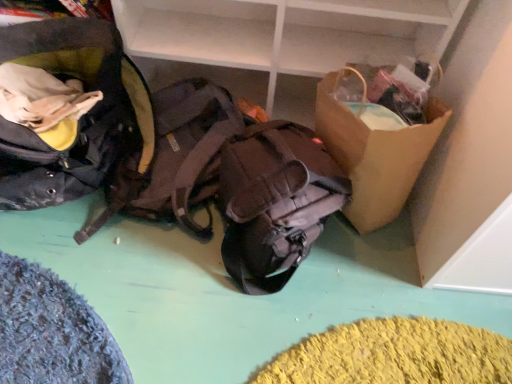
Where is `free spot in front of brown paper bag at right`? free spot in front of brown paper bag at right is located at coordinates (372, 273).